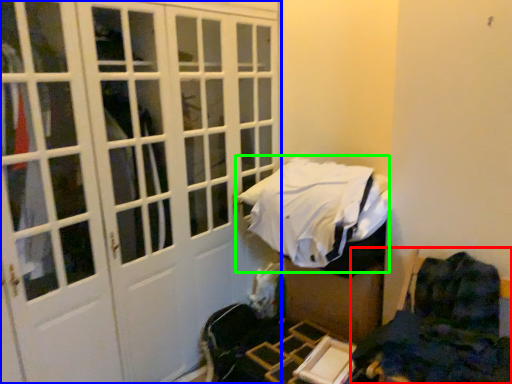
Question: Which object is the farthest from furniture (highlighted by a red box)? Choose among these: door (highlighted by a blue box) or bed (highlighted by a green box).

Choices:
 (A) door
 (B) bed

Answer: (A)